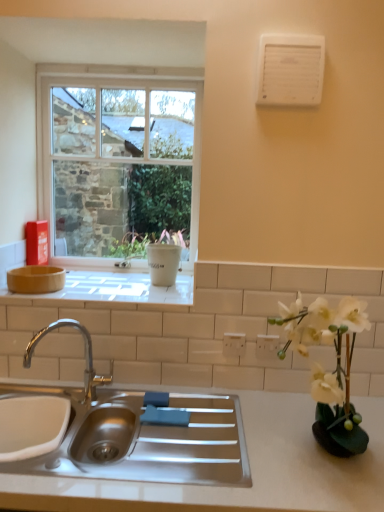
Question: Is matte white tile at upper center smaller than white matte countertop at center?

Choices:
 (A) no
 (B) yes

Answer: (B)

Question: Are matte white tile at upper center and white matte countertop at center beside each other?

Choices:
 (A) no
 (B) yes

Answer: (A)

Question: Would you consider matte white tile at upper center to be distant from white matte countertop at center?

Choices:
 (A) yes
 (B) no

Answer: (B)

Question: From the image's perspective, is matte white tile at upper center located above white matte countertop at center?

Choices:
 (A) yes
 (B) no

Answer: (A)

Question: Considering the relative positions of matte white tile at upper center and white matte countertop at center in the image provided, is matte white tile at upper center to the left of white matte countertop at center from the viewer's perspective?

Choices:
 (A) no
 (B) yes

Answer: (B)

Question: Is white plastic electric outlet at center, which is the first electric outlet from left to right, taller or shorter than stainless steel sink at center?

Choices:
 (A) short
 (B) tall

Answer: (A)

Question: Is white plastic electric outlet at center, which is the first electric outlet from left to right, to the left or to the right of stainless steel sink at center in the image?

Choices:
 (A) right
 (B) left

Answer: (A)

Question: Is white plastic electric outlet at center, placed as the second electric outlet when sorted from right to left, bigger or smaller than stainless steel sink at center?

Choices:
 (A) small
 (B) big

Answer: (A)

Question: Considering the positions of point (223, 343) and point (238, 421), is point (223, 343) closer or farther from the camera than point (238, 421)?

Choices:
 (A) farther
 (B) closer

Answer: (A)

Question: Which is correct: white plastic electric outlet at upper center, the 1th electric outlet in the right-to-left sequence, is inside white plastic electric outlet at center, which is the first electric outlet from left to right, or outside of it?

Choices:
 (A) inside
 (B) outside

Answer: (B)

Question: Relative to white plastic electric outlet at center, which is the first electric outlet from left to right, is white plastic electric outlet at upper center, the 1th electric outlet in the right-to-left sequence, in front or behind?

Choices:
 (A) behind
 (B) front

Answer: (B)

Question: Considering the positions of white plastic electric outlet at upper center, the 1th electric outlet in the right-to-left sequence, and white plastic electric outlet at center, which is the first electric outlet from left to right, in the image, is white plastic electric outlet at upper center, the 1th electric outlet in the right-to-left sequence, taller or shorter than white plastic electric outlet at center, which is the first electric outlet from left to right,?

Choices:
 (A) short
 (B) tall

Answer: (A)

Question: Would you say white plastic electric outlet at upper center, the 1th electric outlet in the right-to-left sequence, is to the left or to the right of white plastic electric outlet at center, which is the first electric outlet from left to right, in the picture?

Choices:
 (A) left
 (B) right

Answer: (B)

Question: From a real-world perspective, is white matte countertop at center above or below white matte vase at right?

Choices:
 (A) below
 (B) above

Answer: (A)

Question: From the image's perspective, relative to white matte vase at right, is white matte countertop at center above or below?

Choices:
 (A) above
 (B) below

Answer: (B)